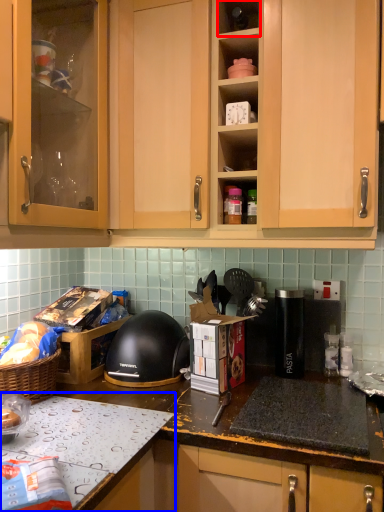
Question: Which of the following is the farthest to the observer, shelf (highlighted by a red box) or countertop (highlighted by a blue box)?

Choices:
 (A) shelf
 (B) countertop

Answer: (A)